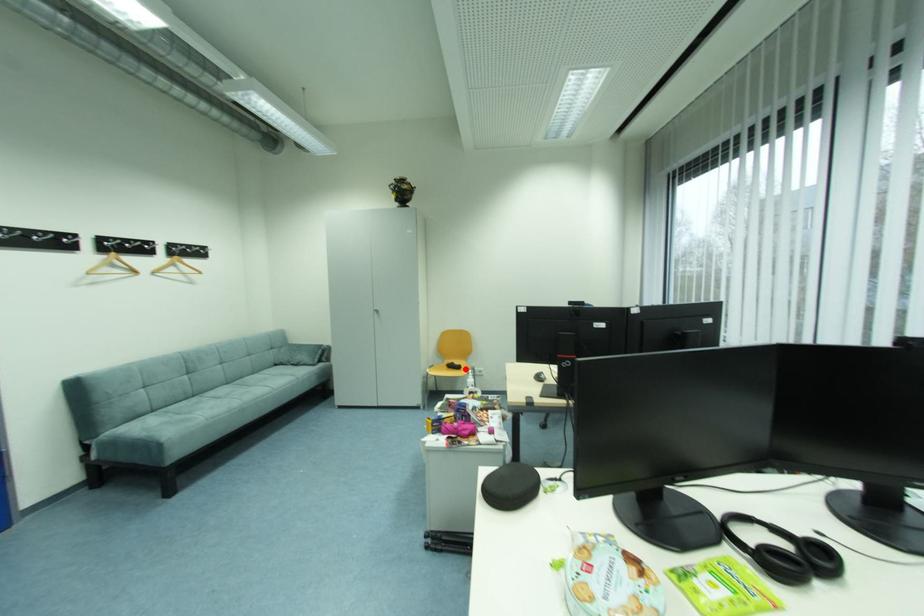
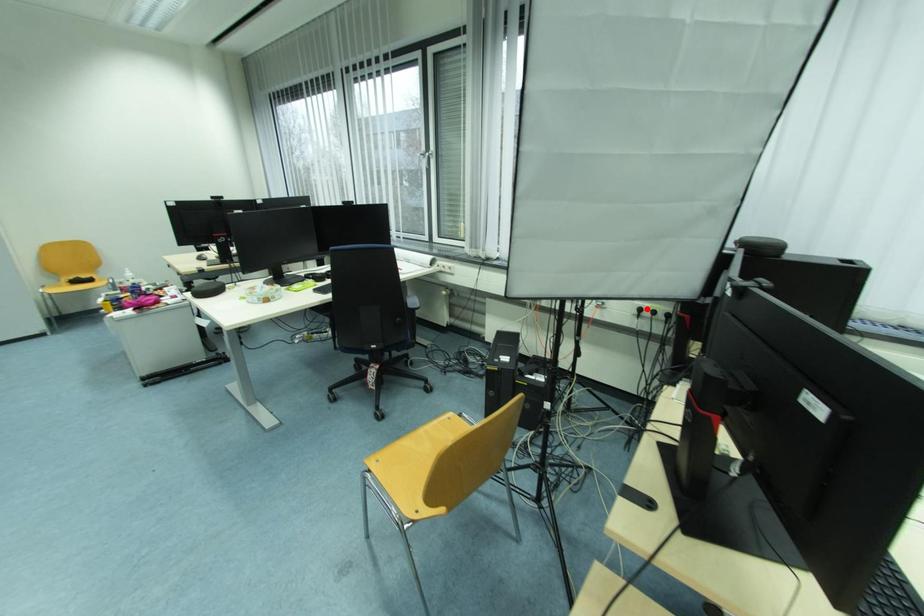
I am providing you with two images of the same scene from different viewpoints. A red point is marked on the first image and another point is marked on the second image. Is the marked point in image1 the same physical position as the marked point in image2?

No